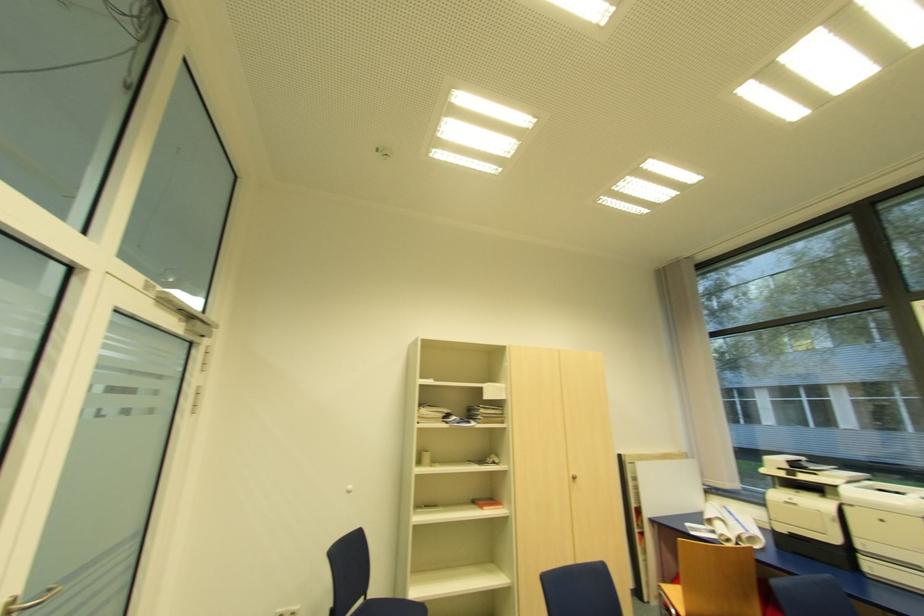
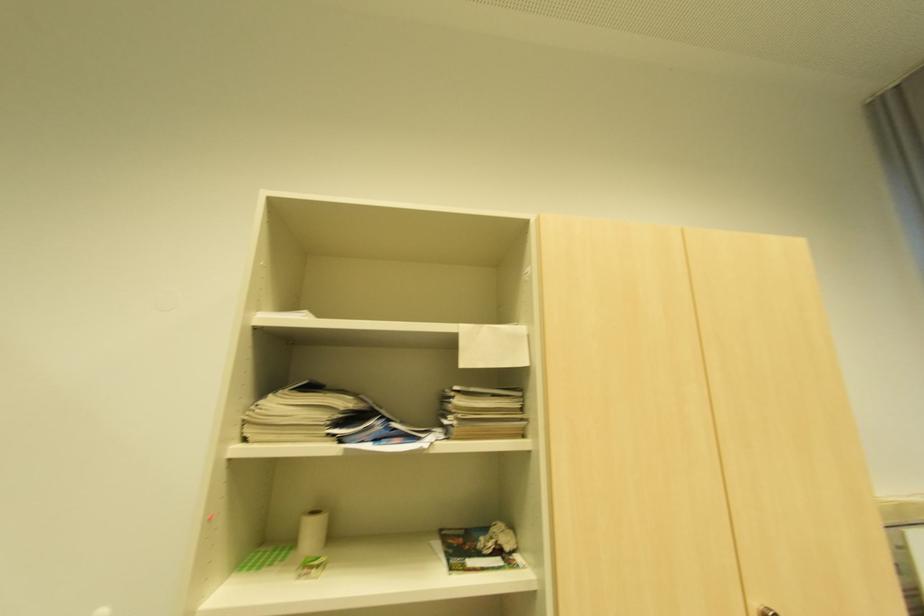
Question: In a continuous first-person perspective shot, in which direction is the camera moving?

Choices:
 (A) Left
 (B) Right
 (C) Forward
 (D) Backward

Answer: (C)